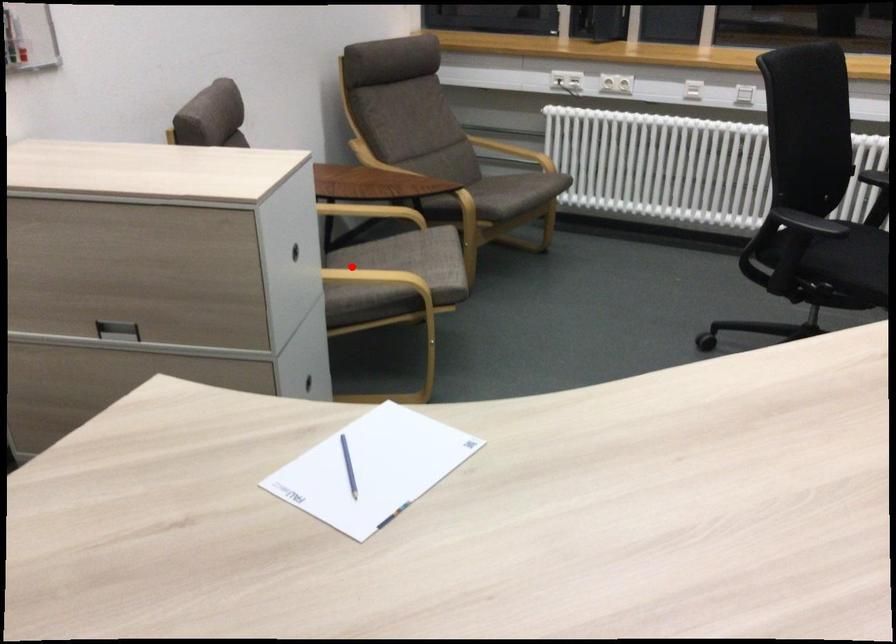
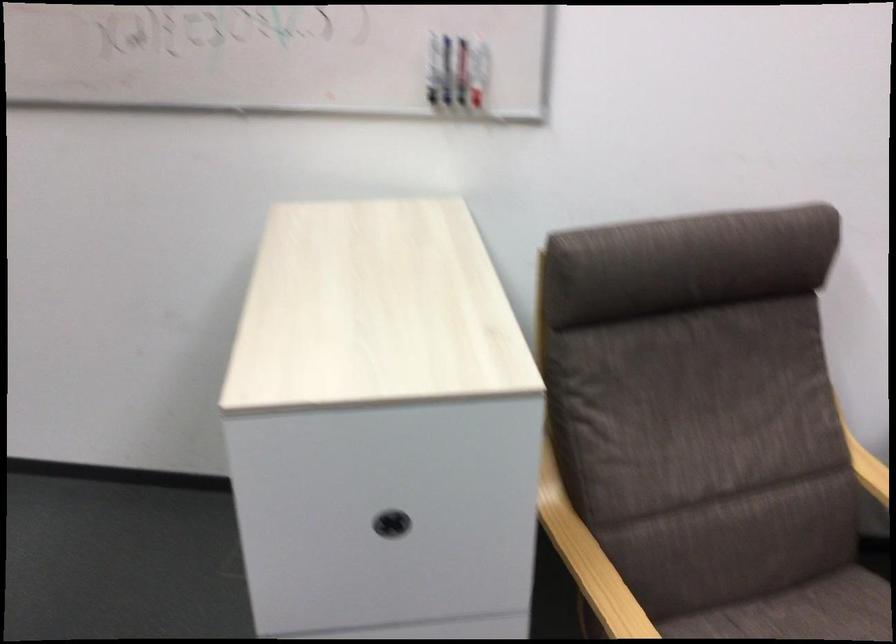
Find the pixel in the second image that matches the highlighted location in the first image.

(800, 612)